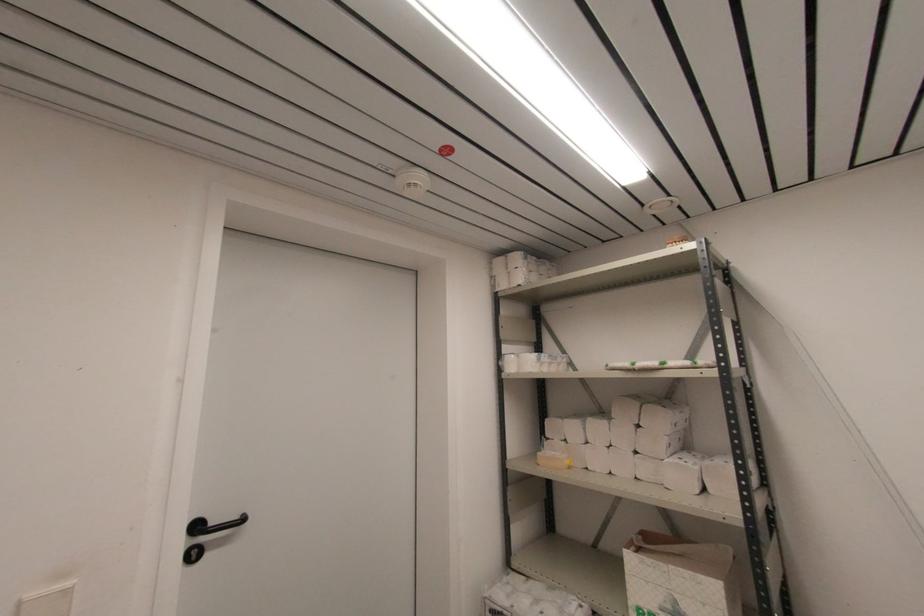
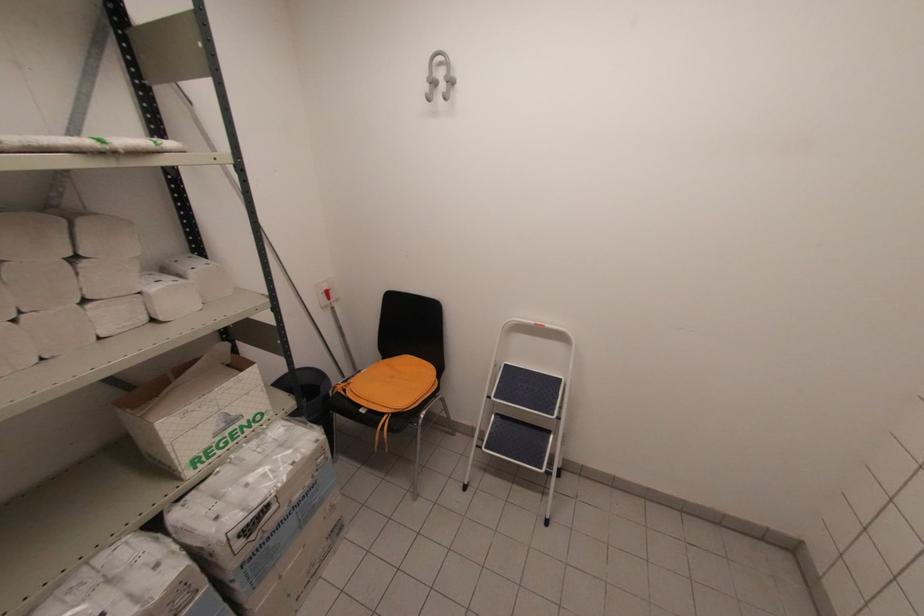
Where in the second image is the point corresponding to point 633,368 from the first image?

(107, 148)